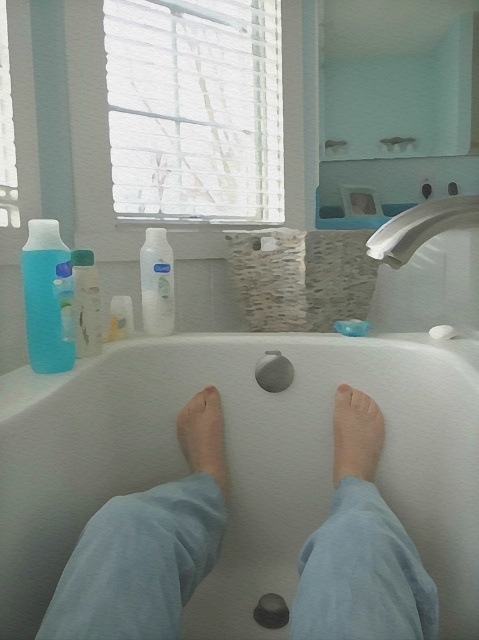
Who is taller, white plastic faucet at upper right or translucent plastic soap at center?

Standing taller between the two is white plastic faucet at upper right.

Is point (428, 209) closer to camera compared to point (354, 333)?

Yes, point (428, 209) is closer to viewer.

Image resolution: width=479 pixels, height=640 pixels. In order to click on white plastic faucet at upper right in this screenshot , I will do `click(421, 227)`.

The height and width of the screenshot is (640, 479). I want to click on pale skin foot at center, so click(x=355, y=435).

You are a GUI agent. You are given a task and a screenshot of the screen. Output one action in this format:
    pyautogui.click(x=<x>, y=<y>)
    Task: Click on the pale skin foot at center
    This screenshot has width=479, height=640.
    Given the screenshot: What is the action you would take?
    pyautogui.click(x=355, y=435)

Can you confirm if pale skin at center is wider than white matte bottle at center?

Yes, pale skin at center is wider than white matte bottle at center.

Does pale skin at center appear under white matte bottle at center?

Indeed, pale skin at center is positioned under white matte bottle at center.

You are a GUI agent. You are given a task and a screenshot of the screen. Output one action in this format:
    pyautogui.click(x=<x>, y=<y>)
    Task: Click on the pale skin at center
    This screenshot has height=640, width=479.
    Given the screenshot: What is the action you would take?
    pyautogui.click(x=204, y=436)